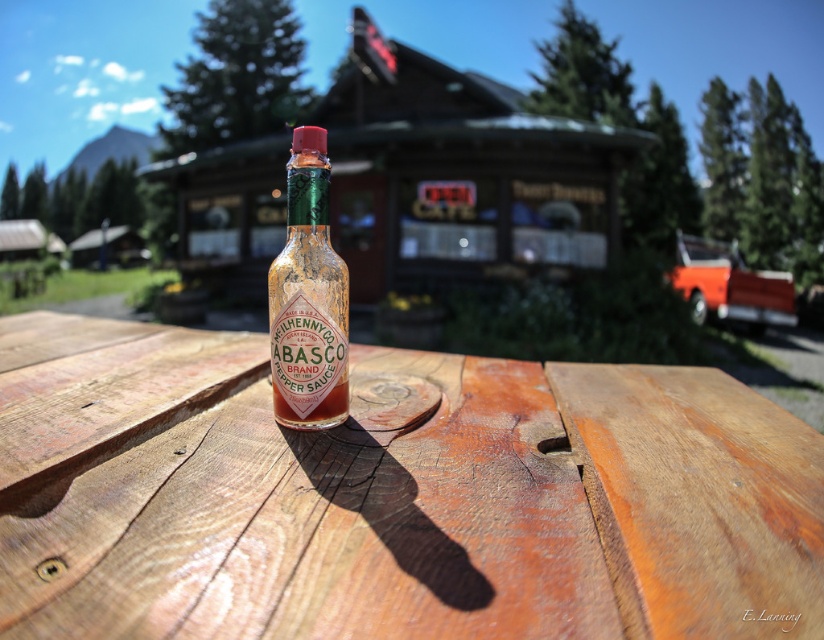
You are setting up a picnic and want to place a napkin between the wooden picnic table at center and the matte glass tabasco bottle at center. Based on their positions, where should you place the napkin?

The wooden picnic table at center is to the left of the matte glass tabasco bottle at center, so you should place the napkin to the left of the bottle or to the right of the table to position it between them.

You are holding a smartphone camera 12 inches away from the wooden picnic table at center. Can you get a clear photo of the table without moving closer?

The wooden picnic table at center is 10.74 inches away from the camera. Since your smartphone camera is 12 inches away, you are slightly farther than the optimal distance. To ensure a clear photo, move 1.26 inches closer to the table.